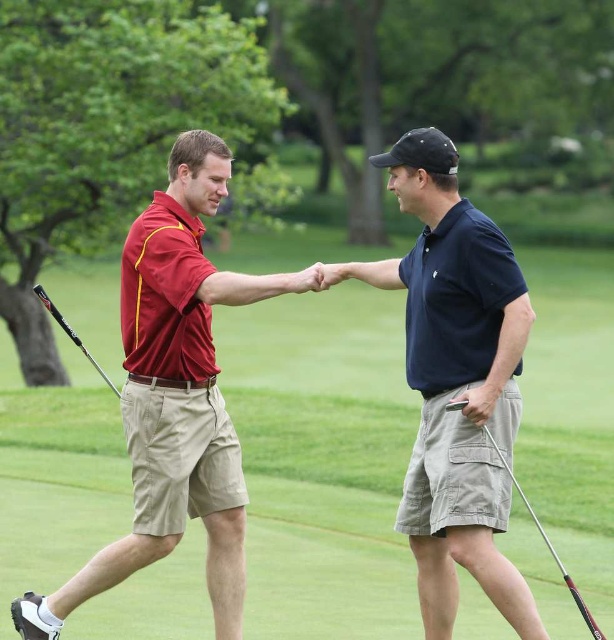
Identify the location of matte red shirt at center. (174, 396).

Is point (17, 614) behind point (445, 296)?

Yes, point (17, 614) is farther from viewer.

Is point (26, 616) positioned after point (468, 220)?

Yes, point (26, 616) is farther from viewer.

Locate an element on the screen. This screenshot has height=640, width=614. matte red shirt at center is located at coordinates (174, 396).

Who is higher up, navy blue shirt at center or matte red shirt at center?

navy blue shirt at center is higher up.

Is navy blue shirt at center closer to the viewer compared to matte red shirt at center?

Yes, navy blue shirt at center is closer to the viewer.

Between point (445, 150) and point (165, 312), which one is positioned in front?

Positioned in front is point (445, 150).

Where is `navy blue shirt at center`? Image resolution: width=614 pixels, height=640 pixels. navy blue shirt at center is located at coordinates (454, 380).

Which of these two, matte red shirt at center or metallic silver golf club at lower right, stands taller?

Standing taller between the two is matte red shirt at center.

Who is positioned more to the right, matte red shirt at center or metallic silver golf club at lower right?

metallic silver golf club at lower right

Identify the location of matte red shirt at center. (x=174, y=396).